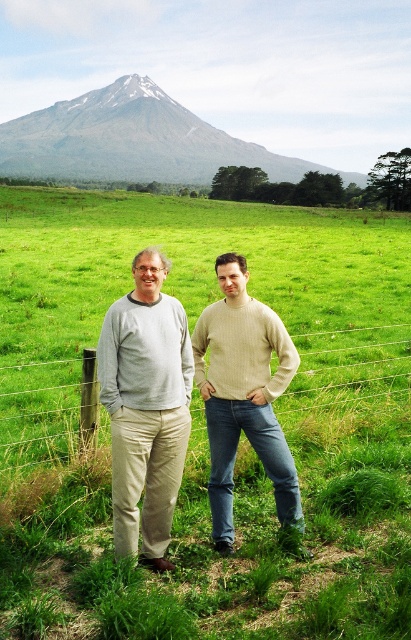
Question: Which is nearer to the light beige sweater at center?

Choices:
 (A) light gray sweater at center
 (B) gray rocky mountain at upper center

Answer: (A)

Question: Where is light beige sweater at center located in relation to wire mesh fence at center in the image?

Choices:
 (A) above
 (B) below

Answer: (B)

Question: Estimate the real-world distances between objects in this image. Which object is closer to the gray rocky mountain at upper center?

Choices:
 (A) light gray sweater at center
 (B) light beige sweater at center

Answer: (B)

Question: Which point is closer to the camera taking this photo?

Choices:
 (A) (115, 372)
 (B) (387, 330)

Answer: (A)

Question: Considering the relative positions of light beige sweater at center and wire mesh fence at center in the image provided, where is light beige sweater at center located with respect to wire mesh fence at center?

Choices:
 (A) right
 (B) left

Answer: (B)

Question: Is light beige sweater at center further to camera compared to light gray sweater at center?

Choices:
 (A) yes
 (B) no

Answer: (A)